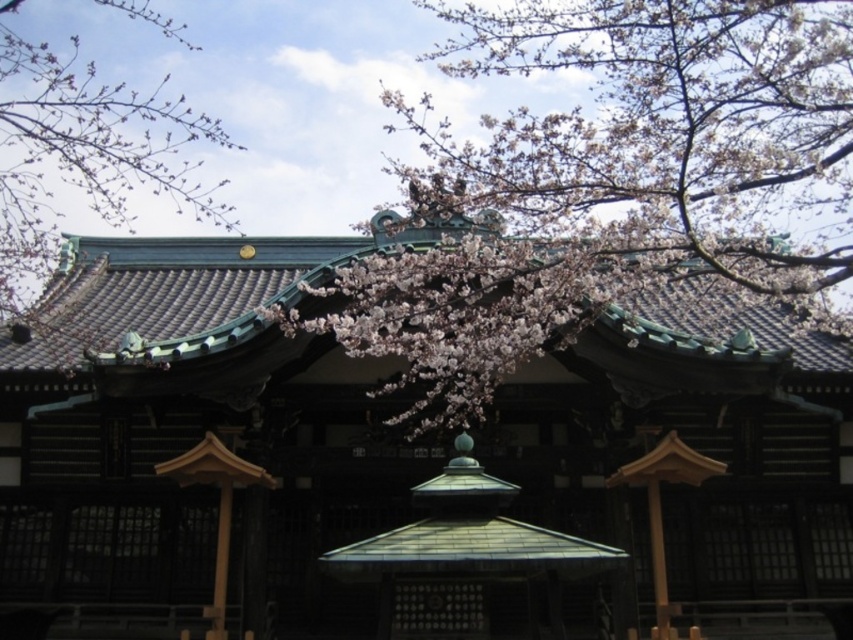
Describe the element at coordinates (605, 184) in the screenshot. I see `pink blossom at center` at that location.

Find the location of a particular element. The image size is (853, 640). pink blossom at center is located at coordinates coord(605,184).

This screenshot has width=853, height=640. Identify the location of pink blossom at center. (605, 184).